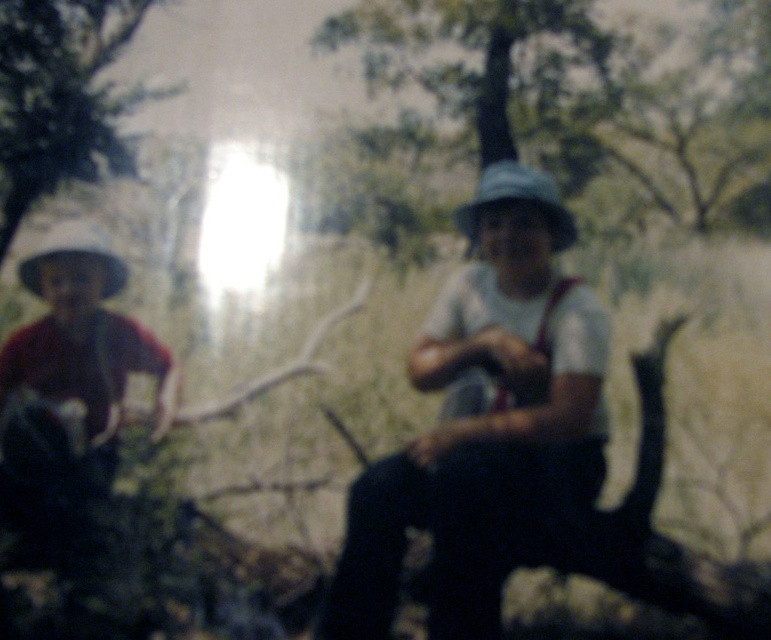
You are a photographer trying to capture a clear shot of the matte white hat at center and the green leafy tree at upper left. Based on their positions, which object is closer to the camera?

The matte white hat at center is closer to the camera than the green leafy tree at upper left because it appears larger and more detailed compared to the tree in the background.

You are a hiker trying to identify landmarks in the forest. You see the matte white hat at center and the green leafy tree at upper left. Which object is closer to you?

The matte white hat at center is closer to you because it is in front of the green leafy tree at upper left.